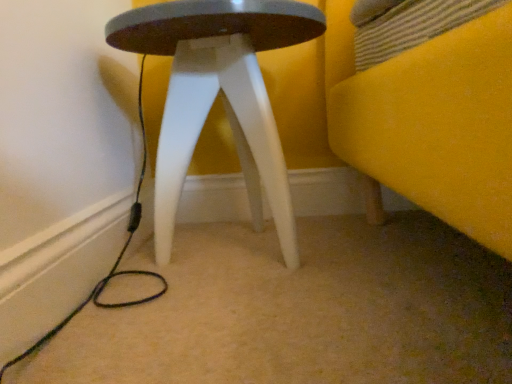
What do you see at coordinates (216, 96) in the screenshot? I see `matte white stool at center` at bounding box center [216, 96].

Where is `matte white stool at center`? This screenshot has width=512, height=384. matte white stool at center is located at coordinates (216, 96).

At what (x,y) coordinates should I click in order to perform the action: click on black cable at lower left. Please return your answer as a coordinate pair (x, y). Looking at the image, I should click on (116, 259).

Image resolution: width=512 pixels, height=384 pixels. Describe the element at coordinates (116, 259) in the screenshot. I see `black cable at lower left` at that location.

Where is `matte white stool at center`? This screenshot has width=512, height=384. matte white stool at center is located at coordinates (216, 96).

Considering the positions of objects black cable at lower left and matte white stool at center in the image provided, who is more to the left, black cable at lower left or matte white stool at center?

Positioned to the left is black cable at lower left.

Considering the positions of objects black cable at lower left and matte white stool at center in the image provided, who is behind, black cable at lower left or matte white stool at center?

matte white stool at center is further away from the camera.

Is point (141, 61) positioned in front of point (250, 187)?

No, (141, 61) is behind (250, 187).

From the image's perspective, which object appears higher, black cable at lower left or matte white stool at center?

matte white stool at center appears higher in the image.

From a real-world perspective, is black cable at lower left on matte white stool at center?

Actually, black cable at lower left is physically below matte white stool at center in the real world.

In terms of width, does black cable at lower left look wider or thinner when compared to matte white stool at center?

black cable at lower left is thinner than matte white stool at center.

Between black cable at lower left and matte white stool at center, which one has less height?

Standing shorter between the two is black cable at lower left.

Considering the sizes of objects black cable at lower left and matte white stool at center in the image provided, who is bigger, black cable at lower left or matte white stool at center?

With larger size is matte white stool at center.

Does black cable at lower left contain matte white stool at center?

That's incorrect, matte white stool at center is not inside black cable at lower left.

Is black cable at lower left not near matte white stool at center?

They are positioned close to each other.

Could you tell me if black cable at lower left is turned towards matte white stool at center?

Yes, black cable at lower left is oriented towards matte white stool at center.

Can you tell me how much black cable at lower left and matte white stool at center differ in facing direction?

A: 91.5 degrees separate the facing orientations of black cable at lower left and matte white stool at center.

How distant is black cable at lower left from matte white stool at center?

black cable at lower left and matte white stool at center are 11.39 inches apart from each other.

Locate an element on the screen. This screenshot has width=512, height=384. cable below the matte white stool at center (from the image's perspective) is located at coordinates (x=116, y=259).

Considering the relative positions of matte white stool at center and black cable at lower left in the image provided, is matte white stool at center to the left of black cable at lower left from the viewer's perspective?

No.

Which object is closer to the camera taking this photo, matte white stool at center or black cable at lower left?

black cable at lower left is more forward.

Between point (208, 26) and point (142, 62), which one is positioned in front?

The point (208, 26) is closer.

From the image's perspective, is matte white stool at center positioned above or below black cable at lower left?

Based on their image positions, matte white stool at center is located above black cable at lower left.

From a real-world perspective, is matte white stool at center physically above black cable at lower left?

Yes.

Is matte white stool at center wider than black cable at lower left?

Yes.

Who is taller, matte white stool at center or black cable at lower left?

matte white stool at center is taller.

Considering the relative sizes of matte white stool at center and black cable at lower left in the image provided, is matte white stool at center bigger than black cable at lower left?

Correct, matte white stool at center is larger in size than black cable at lower left.

Would you say matte white stool at center is outside black cable at lower left?

matte white stool at center lies outside black cable at lower left's area.

Is matte white stool at center not close to black cable at lower left?

No, matte white stool at center is in close proximity to black cable at lower left.

Is matte white stool at center facing towards black cable at lower left?

No, matte white stool at center is not oriented towards black cable at lower left.

Can you tell me how much matte white stool at center and black cable at lower left differ in facing direction?

91.5 degrees.

Identify the location of cable that appears on the left of matte white stool at center. The image size is (512, 384). (116, 259).

You are a GUI agent. You are given a task and a screenshot of the screen. Output one action in this format:
    pyautogui.click(x=<x>, y=<y>)
    Task: Click on the cable that is below the matte white stool at center (from the image's perspective)
    The width and height of the screenshot is (512, 384).
    Given the screenshot: What is the action you would take?
    pyautogui.click(x=116, y=259)

Find the location of a particular element. The image size is (512, 384). stool behind the black cable at lower left is located at coordinates (216, 96).